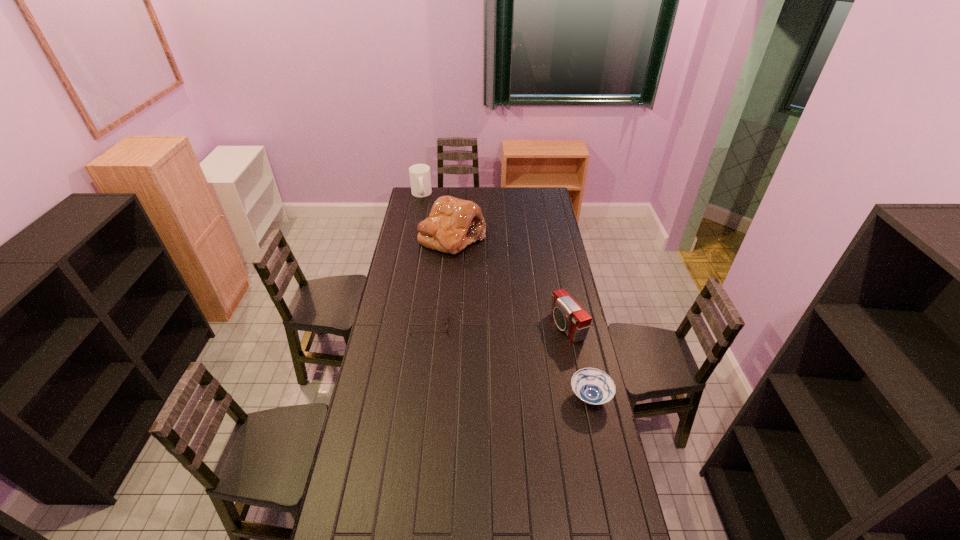
The width and height of the screenshot is (960, 540). What are the coordinates of `blank region between the nearest object and the shortest object` in the screenshot? It's located at (510, 361).

This screenshot has width=960, height=540. Identify the location of unoccupied position between the camera and the second farthest object. (510, 282).

Where is `unoccupied area between the farthest object and the nearest object`? This screenshot has height=540, width=960. unoccupied area between the farthest object and the nearest object is located at coordinates (506, 295).

Identify the location of free spot between the sunglasses and the second shortest object. The image size is (960, 540). (510, 361).

The image size is (960, 540). I want to click on free area in between the farthest object and the shortest object, so (x=425, y=260).

Where is `free space between the nearest object and the fourth nearest object`? free space between the nearest object and the fourth nearest object is located at coordinates 521,318.

Identify the location of vacant space that's between the camera and the nearest object. (579, 362).

Identify the location of object that is the second nearest to the camera. This screenshot has width=960, height=540. (453, 223).

Find the location of a particular element. object that stands as the second closest to the farthest object is located at coordinates (416, 308).